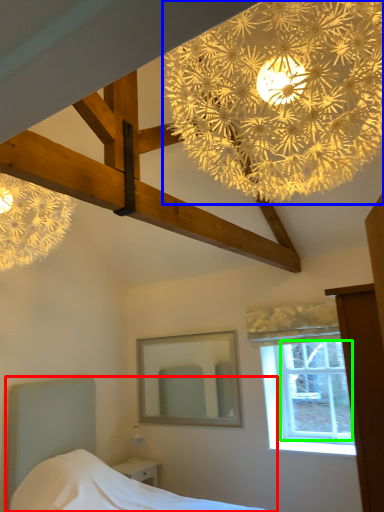
Question: Estimate the real-world distances between objects in this image. Which object is closer to bed (highlighted by a red box), flower (highlighted by a blue box) or window screen (highlighted by a green box)?

Choices:
 (A) flower
 (B) window screen

Answer: (B)